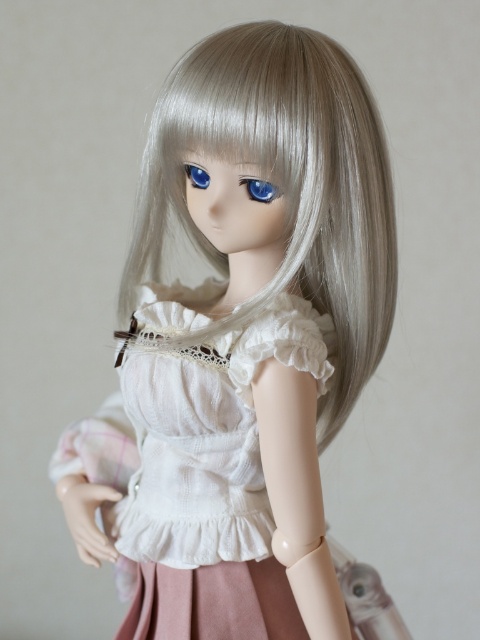
Is white lace dress at center smaller than blue glossy eye at upper center?

No, white lace dress at center is not smaller than blue glossy eye at upper center.

Which is more to the left, white lace dress at center or blue glossy eye at upper center?

white lace dress at center is more to the left.

Who is more distant from viewer, (143, 624) or (207, 182)?

The point (143, 624) is behind.

This screenshot has height=640, width=480. Identify the location of white lace dress at center. (203, 428).

This screenshot has width=480, height=640. What are the coordinates of `blue glossy eye at center` in the screenshot? It's located at (259, 189).

Is blue glossy eye at center behind blue glossy eye at upper center?

No, it is in front of blue glossy eye at upper center.

This screenshot has width=480, height=640. What do you see at coordinates (259, 189) in the screenshot?
I see `blue glossy eye at center` at bounding box center [259, 189].

This screenshot has height=640, width=480. Find the location of `blue glossy eye at center`. blue glossy eye at center is located at coordinates (259, 189).

Locate an element on the screen. matte white dress at center is located at coordinates (240, 342).

What do you see at coordinates (240, 342) in the screenshot? Image resolution: width=480 pixels, height=640 pixels. I see `matte white dress at center` at bounding box center [240, 342].

Is point (260, 604) positioned after point (134, 458)?

No, it is in front of (134, 458).

Where is `matte white dress at center`? This screenshot has height=640, width=480. matte white dress at center is located at coordinates (240, 342).